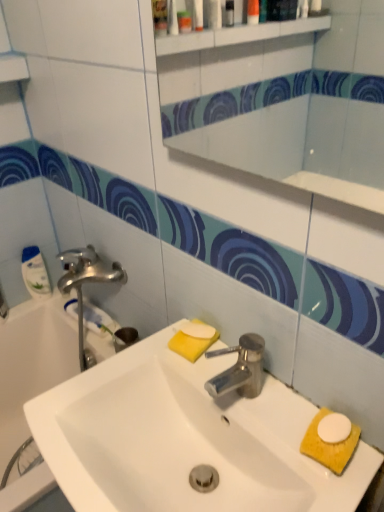
Question: Is white glossy bathtub at left in front of or behind white glossy bottle at left in the image?

Choices:
 (A) front
 (B) behind

Answer: (A)

Question: Does point (36, 335) appear closer or farther from the camera than point (21, 269)?

Choices:
 (A) farther
 (B) closer

Answer: (A)

Question: Estimate the real-world distances between objects in this image. Which object is farther from the white glossy sink at center?

Choices:
 (A) yellow sponge at lower right
 (B) white glossy mirror at upper center
 (C) white glossy bathtub at left
 (D) white matte soap at center
 (E) white glossy bottle at left

Answer: (B)

Question: Which object is the farthest from the white glossy sink at center?

Choices:
 (A) yellow sponge at lower right
 (B) white matte soap at center
 (C) white glossy mirror at upper center
 (D) white glossy bottle at left
 (E) white glossy bathtub at left

Answer: (C)